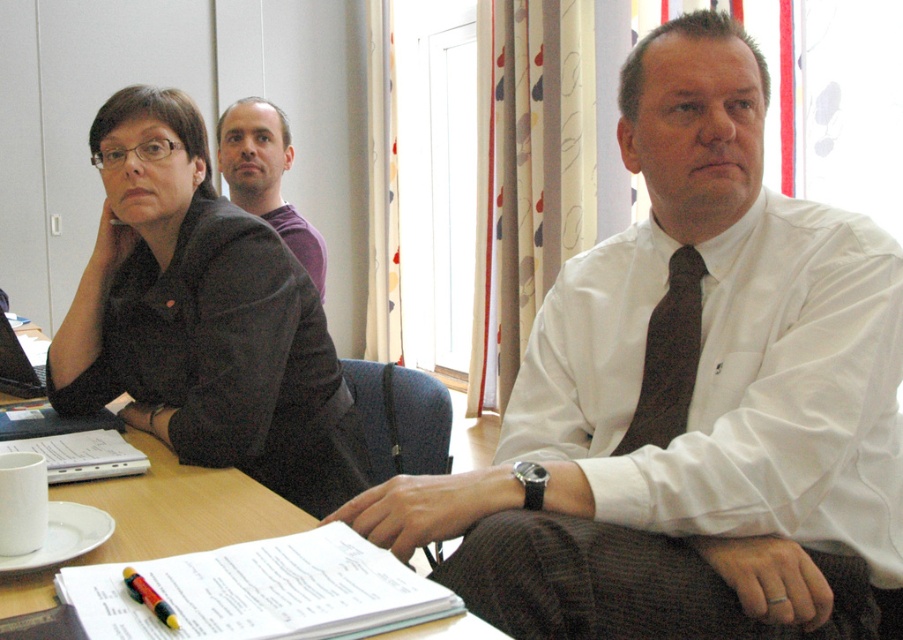
Question: Based on their relative distances, which object is nearer to the dark brown textured tie at center?

Choices:
 (A) white shirt at center
 (B) white cotton dress shirt at center
 (C) matte black shirt at upper left

Answer: (B)

Question: Observing the image, what is the correct spatial positioning of white shirt at center in reference to multicolored plastic pen at lower left?

Choices:
 (A) above
 (B) below

Answer: (A)

Question: Can you confirm if white cotton dress shirt at center is positioned above multicolored plastic pen at lower left?

Choices:
 (A) no
 (B) yes

Answer: (B)

Question: Does white cotton dress shirt at center have a larger size compared to purple cotton shirt at upper center?

Choices:
 (A) yes
 (B) no

Answer: (B)

Question: Estimate the real-world distances between objects in this image. Which object is closer to the white cotton dress shirt at center?

Choices:
 (A) multicolored plastic pen at lower left
 (B) white shirt at center
 (C) matte black shirt at upper left

Answer: (B)

Question: Which point is closer to the camera?

Choices:
 (A) white shirt at center
 (B) purple cotton shirt at upper center
 (C) matte black shirt at upper left

Answer: (A)